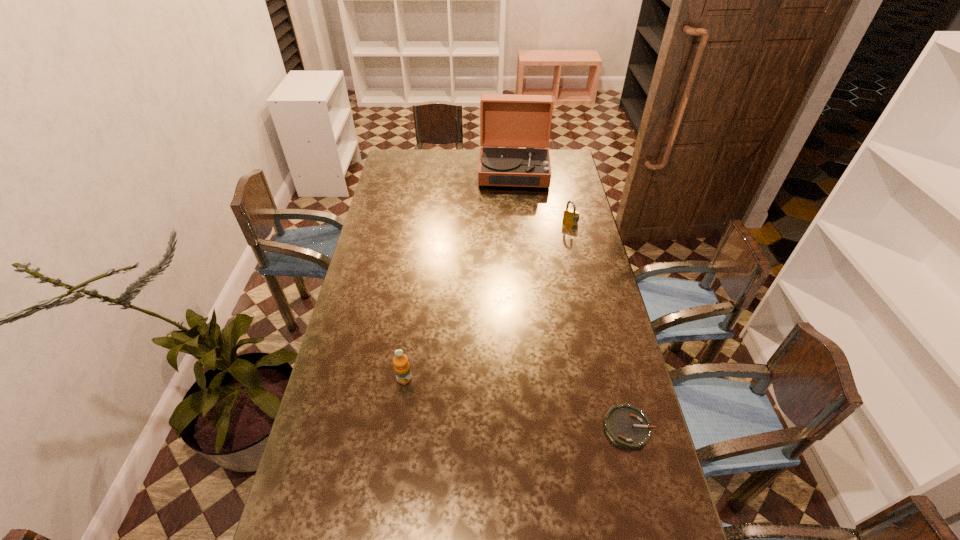
Where is `free spot that satisfies the following two spatial constraints: 1. on the front side of the ashtray; 2. on the right side of the padlock`? This screenshot has width=960, height=540. free spot that satisfies the following two spatial constraints: 1. on the front side of the ashtray; 2. on the right side of the padlock is located at coordinates (618, 428).

Locate an element on the screen. The width and height of the screenshot is (960, 540). free region that satisfies the following two spatial constraints: 1. on the front side of the third nearest object; 2. on the right side of the tallest object is located at coordinates (518, 223).